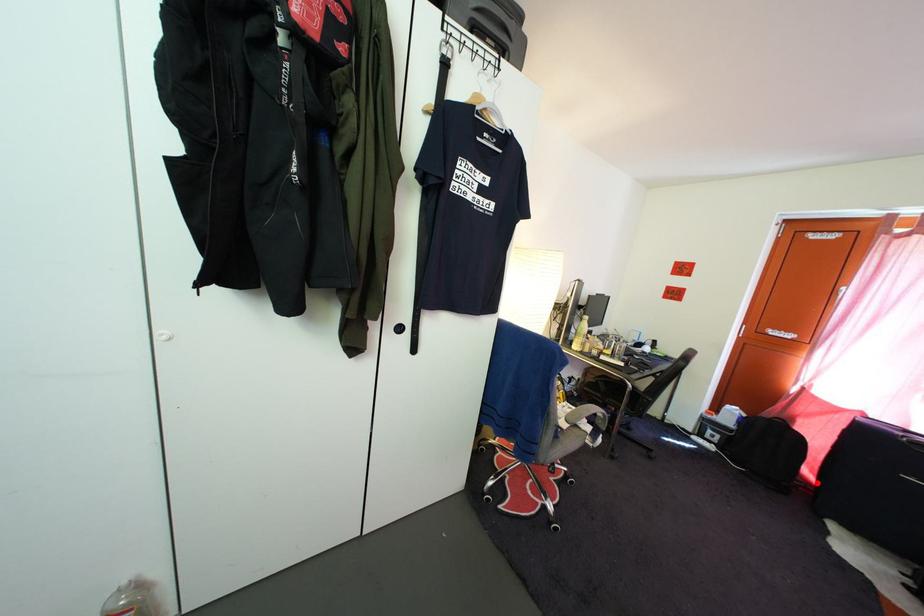
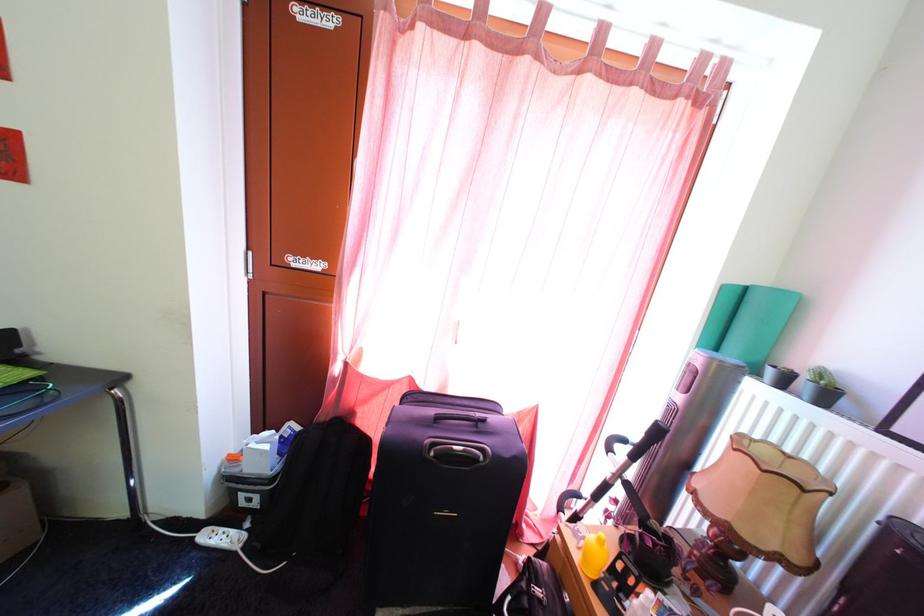
Question: I am providing you with two images of the same scene from different viewpoints. A red point is marked on the first image. At the location where the point appears in image 1, is it still visible in image 2?

Choices:
 (A) Yes
 (B) No

Answer: (B)